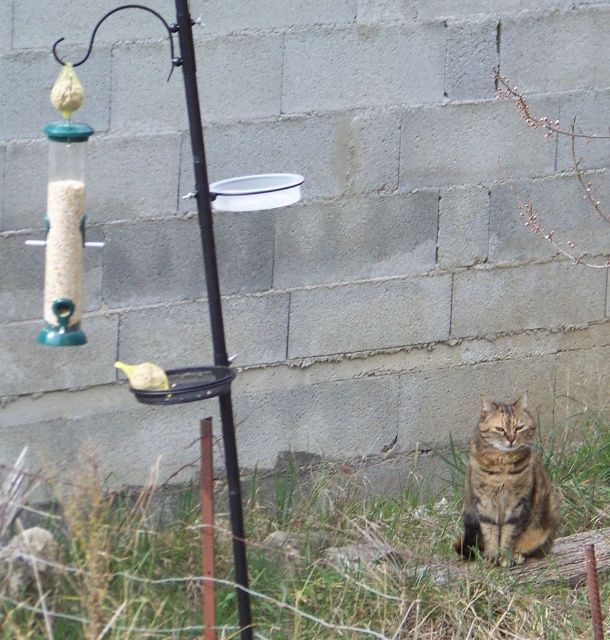
Question: Does tabby fur cat at lower right lie behind yellow matte bird at left?

Choices:
 (A) no
 (B) yes

Answer: (A)

Question: Where is green grass at lower right located in relation to yellow matte bird at left in the image?

Choices:
 (A) right
 (B) left

Answer: (A)

Question: Estimate the real-world distances between objects in this image. Which object is farther from the yellow matte bird at left?

Choices:
 (A) black metal pole at center
 (B) green grass at lower right
 (C) tabby fur cat at lower right

Answer: (A)

Question: Observing the image, what is the correct spatial positioning of green grass at lower right in reference to black metal pole at center?

Choices:
 (A) left
 (B) right

Answer: (B)

Question: Among these objects, which one is nearest to the camera?

Choices:
 (A) tabby fur cat at lower right
 (B) black metal pole at center
 (C) yellow matte bird at left

Answer: (B)

Question: Which point is farther from the camera taking this photo?

Choices:
 (A) (207, 262)
 (B) (140, 387)
 (C) (504, 557)

Answer: (C)